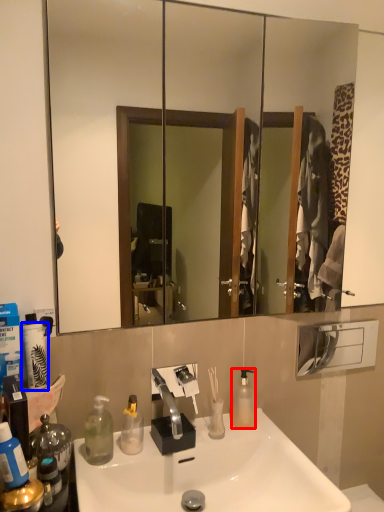
Question: Which point is closer to the camera, bottle (highlighted by a red box) or toilet paper (highlighted by a blue box)?

Choices:
 (A) bottle
 (B) toilet paper

Answer: (B)